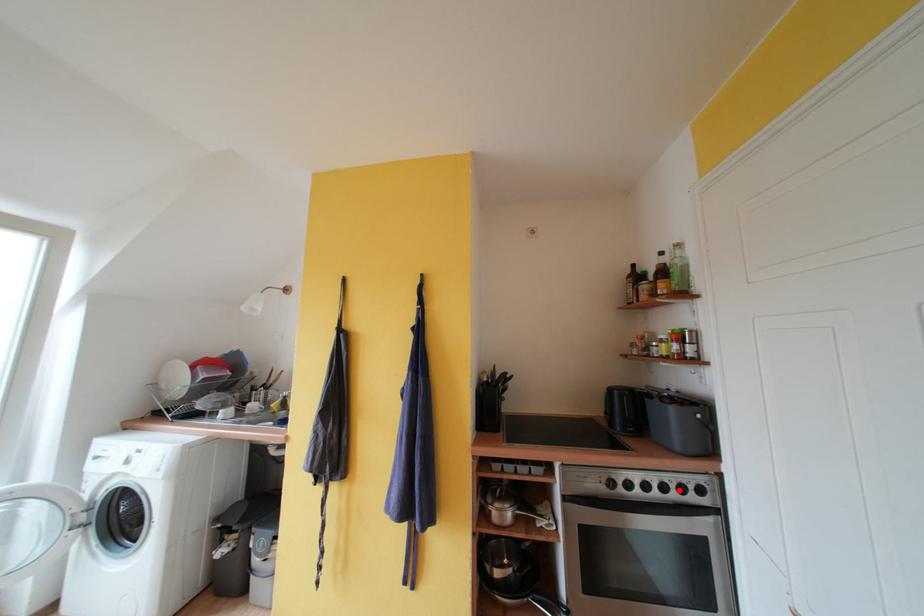
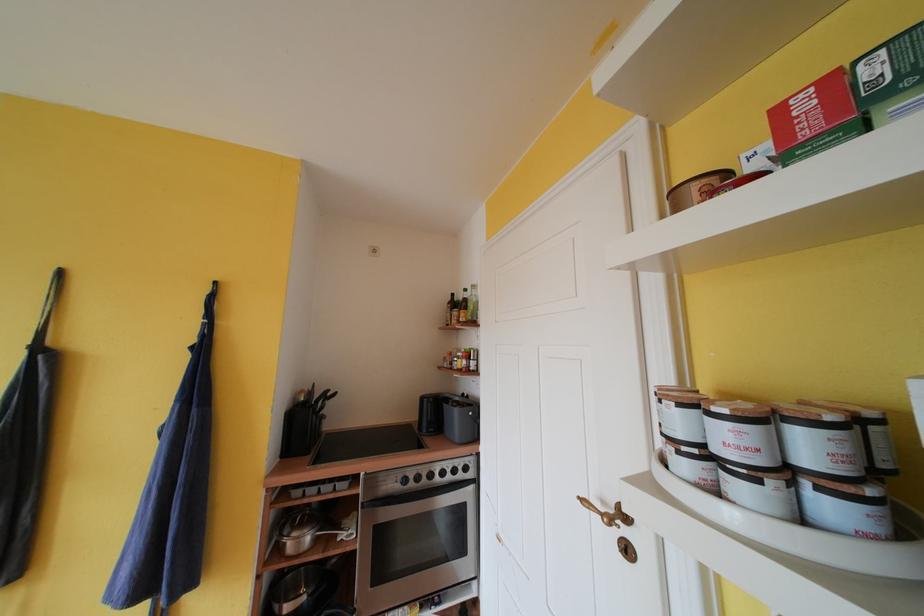
Question: I am providing you with two images of the same scene from different viewpoints. A red point is shown in image1. For the corresponding object point in image2, is it positioned nearer or farther from the camera?

Choices:
 (A) Nearer
 (B) Farther

Answer: (B)